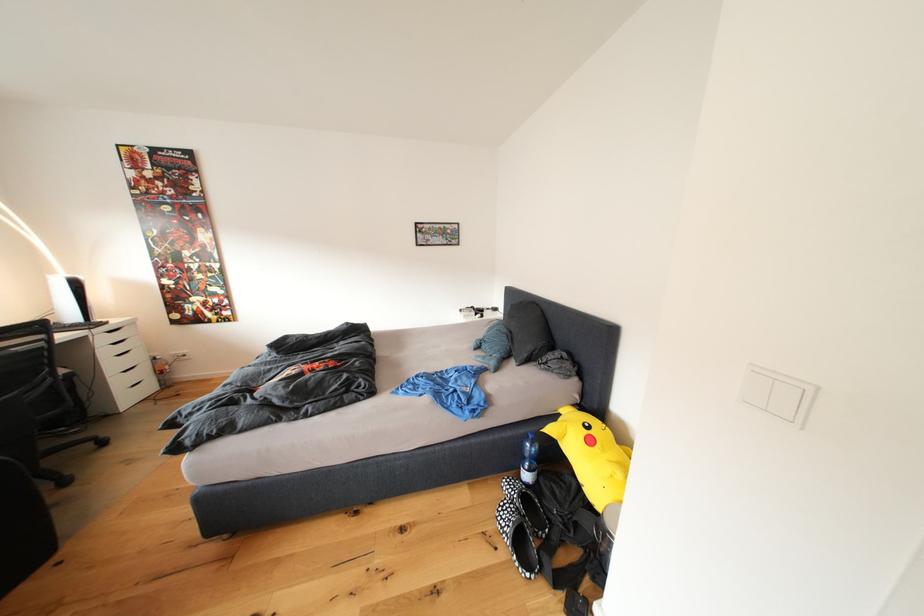
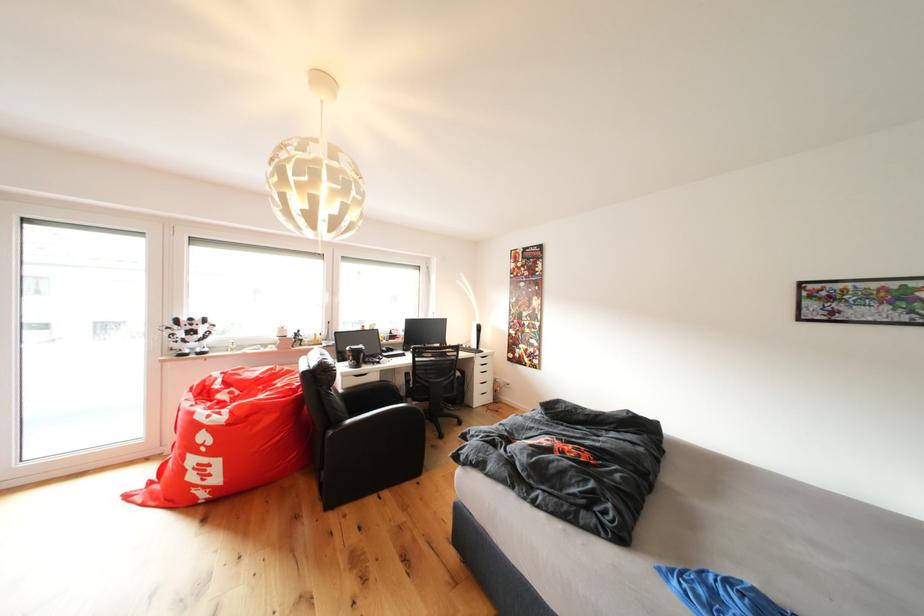
In the second image, find the point that corresponds to (x=106, y=325) in the first image.

(490, 354)